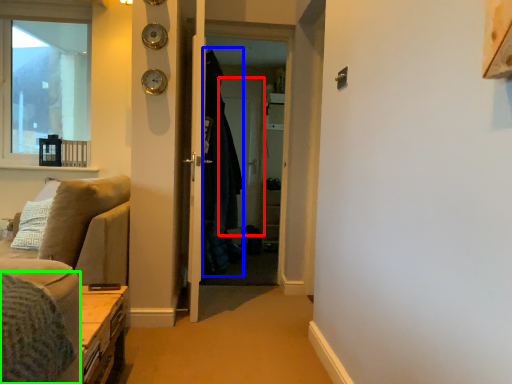
Question: Estimate the real-world distances between objects in this image. Which object is closer to screen door (highlighted by a red box), robe (highlighted by a blue box) or bedding (highlighted by a green box)?

Choices:
 (A) robe
 (B) bedding

Answer: (A)